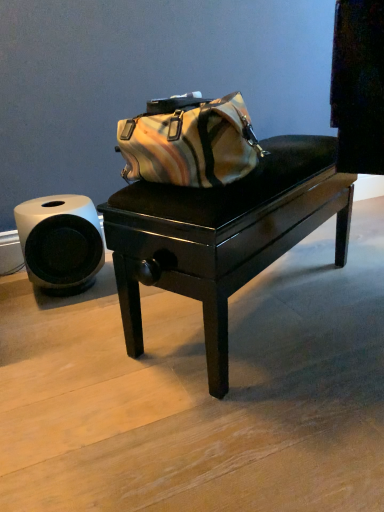
The height and width of the screenshot is (512, 384). What do you see at coordinates (223, 234) in the screenshot?
I see `glossy black table at center` at bounding box center [223, 234].

Where is `glossy black table at center`? glossy black table at center is located at coordinates click(223, 234).

What is the approximate width of glossy black table at center?

The width of glossy black table at center is 34.36 centimeters.

Measure the distance between point (65,255) and camera.

Point (65,255) and camera are 1.42 meters apart.

Locate an element on the screen. white matte toilet paper at left is located at coordinates (60, 242).

The width and height of the screenshot is (384, 512). Describe the element at coordinates (60, 242) in the screenshot. I see `white matte toilet paper at left` at that location.

You are a GUI agent. You are given a task and a screenshot of the screen. Output one action in this format:
    pyautogui.click(x=<x>, y=<y>)
    Task: Click on the glossy black table at center
    
    Given the screenshot: What is the action you would take?
    pyautogui.click(x=223, y=234)

Considering the relative positions of white matte toilet paper at left and glossy black table at center in the image provided, is white matte toilet paper at left to the left or to the right of glossy black table at center?

Clearly, white matte toilet paper at left is on the left of glossy black table at center in the image.

Which is in front, white matte toilet paper at left or glossy black table at center?

glossy black table at center is in front.

Does point (44, 234) come behind point (208, 238)?

Yes.

From the image's perspective, is white matte toilet paper at left over glossy black table at center?

No.

From a real-world perspective, is white matte toilet paper at left below glossy black table at center?

Correct, in the physical world, white matte toilet paper at left is lower than glossy black table at center.

Between white matte toilet paper at left and glossy black table at center, which one has smaller width?

With smaller width is white matte toilet paper at left.

Who is shorter, white matte toilet paper at left or glossy black table at center?

white matte toilet paper at left is shorter.

Can you confirm if white matte toilet paper at left is bigger than glossy black table at center?

Incorrect, white matte toilet paper at left is not larger than glossy black table at center.

Consider the image. Is glossy black table at center surrounded by white matte toilet paper at left?

Actually, glossy black table at center is outside white matte toilet paper at left.

Are white matte toilet paper at left and glossy black table at center located far from each other?

No, there isn't a large distance between white matte toilet paper at left and glossy black table at center.

Is white matte toilet paper at left turned away from glossy black table at center?

No.

In the image, there is a glossy black table at center. Identify the location of toilet paper below it (from a real-world perspective). (60, 242).

Which is more to the right, glossy black table at center or white matte toilet paper at left?

Result: Positioned to the right is glossy black table at center.

Which object is further away from the camera taking this photo, glossy black table at center or white matte toilet paper at left?

Positioned behind is white matte toilet paper at left.

From the picture: Which point is more forward, [205,278] or [47,261]?

The point [205,278] is more forward.

From the image's perspective, is glossy black table at center above or below white matte toilet paper at left?

glossy black table at center is situated higher than white matte toilet paper at left in the image.

From a real-world perspective, who is located lower, glossy black table at center or white matte toilet paper at left?

From a 3D spatial view, white matte toilet paper at left is below.

In terms of width, does glossy black table at center look wider or thinner when compared to white matte toilet paper at left?

glossy black table at center is wider than white matte toilet paper at left.

Is glossy black table at center shorter than white matte toilet paper at left?

No, glossy black table at center is not shorter than white matte toilet paper at left.

Considering the sizes of glossy black table at center and white matte toilet paper at left in the image, is glossy black table at center bigger or smaller than white matte toilet paper at left?

Clearly, glossy black table at center is larger in size than white matte toilet paper at left.

Choose the correct answer: Is glossy black table at center inside white matte toilet paper at left or outside it?

glossy black table at center cannot be found inside white matte toilet paper at left.

Would you say glossy black table at center is a long distance from white matte toilet paper at left?

That's not correct — glossy black table at center is a little close to white matte toilet paper at left.

Is glossy black table at center positioned with its back to white matte toilet paper at left?

Absolutely, glossy black table at center is directed away from white matte toilet paper at left.

Can you tell me how much glossy black table at center and white matte toilet paper at left differ in facing direction?

There is a 27.9-degree angle between the facing directions of glossy black table at center and white matte toilet paper at left.

This screenshot has width=384, height=512. In order to click on toilet paper below the glossy black table at center (from the image's perspective) in this screenshot , I will do `click(60, 242)`.

Find the location of a particular element. toilet paper located on the left of glossy black table at center is located at coordinates (60, 242).

Image resolution: width=384 pixels, height=512 pixels. In order to click on toilet paper located behind the glossy black table at center in this screenshot , I will do `click(60, 242)`.